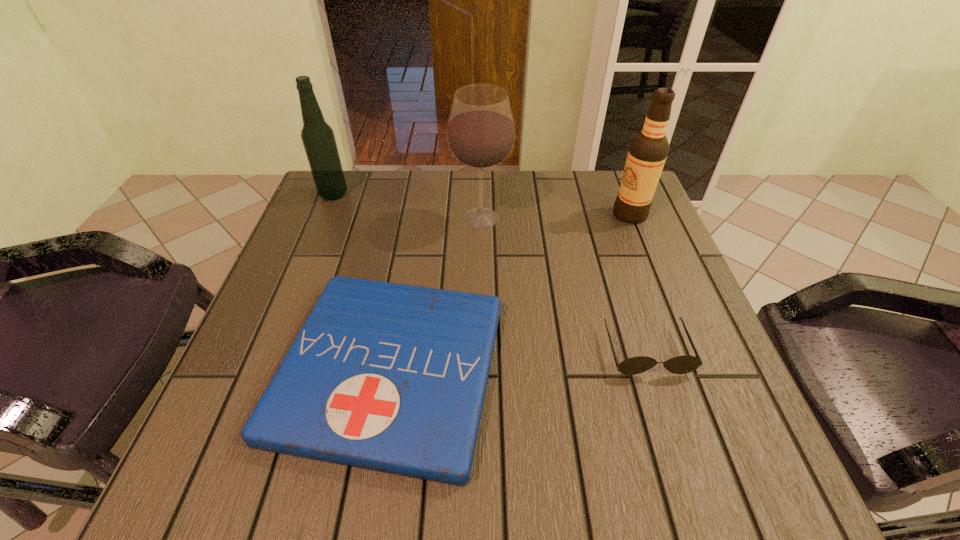
The width and height of the screenshot is (960, 540). In order to click on vacant space in between the rightmost alcohol and the first-aid kit in this screenshot , I will do `click(510, 292)`.

You are a GUI agent. You are given a task and a screenshot of the screen. Output one action in this format:
    pyautogui.click(x=<x>, y=<y>)
    Task: Click on the blank region between the sunglasses and the second alcohol from right to left
    
    Given the screenshot: What is the action you would take?
    pyautogui.click(x=564, y=284)

Image resolution: width=960 pixels, height=540 pixels. I want to click on vacant area that lies between the rightmost alcohol and the sunglasses, so click(638, 282).

Identify the location of the fourth closest object to the rightmost alcohol. (318, 138).

Choose which object is the second nearest neighbor to the leftmost alcohol. Please provide its 2D coordinates. Your answer should be formatted as a tuple, i.e. [(x, y)], where the tuple contains the x and y coordinates of a point satisfying the conditions above.

[(389, 377)]

Identify which alcohol is located as the second nearest to the first-aid kit. Please provide its 2D coordinates. Your answer should be formatted as a tuple, i.e. [(x, y)], where the tuple contains the x and y coordinates of a point satisfying the conditions above.

[(318, 138)]

Locate which alcohol ranks second in proximity to the second alcohol from right to left. Please provide its 2D coordinates. Your answer should be formatted as a tuple, i.e. [(x, y)], where the tuple contains the x and y coordinates of a point satisfying the conditions above.

[(318, 138)]

Locate an element on the screen. free space that satisfies the following two spatial constraints: 1. on the label of the rightmost alcohol; 2. on the front-facing side of the sunglasses is located at coordinates (684, 350).

This screenshot has width=960, height=540. I want to click on vacant point that satisfies the following two spatial constraints: 1. on the label of the rightmost alcohol; 2. on the front-facing side of the sunglasses, so click(x=684, y=350).

This screenshot has height=540, width=960. In order to click on free space that satisfies the following two spatial constraints: 1. on the back side of the first-aid kit; 2. on the left side of the second alcohol from right to left in this screenshot , I will do `click(416, 219)`.